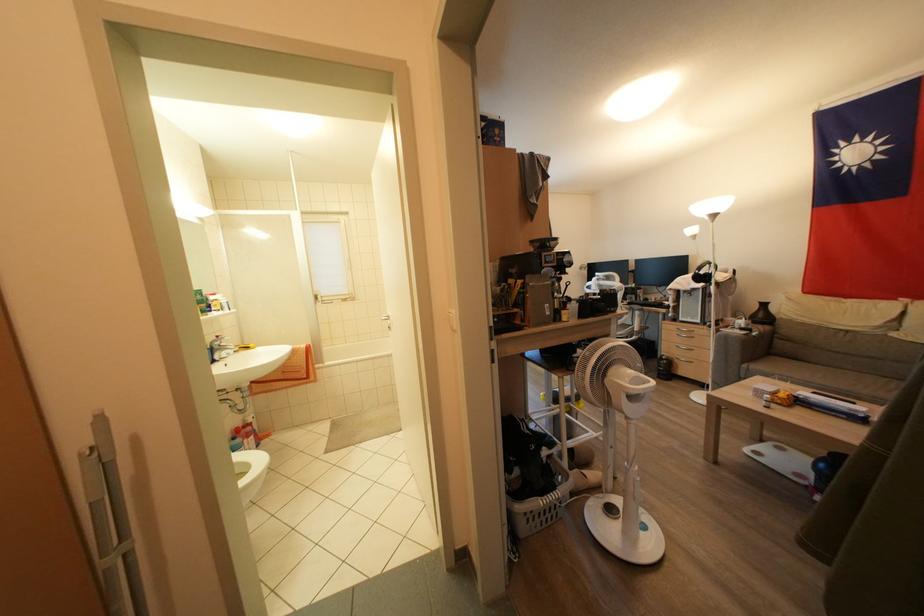
This screenshot has height=616, width=924. What do you see at coordinates (249, 492) in the screenshot?
I see `the white toilet seat` at bounding box center [249, 492].